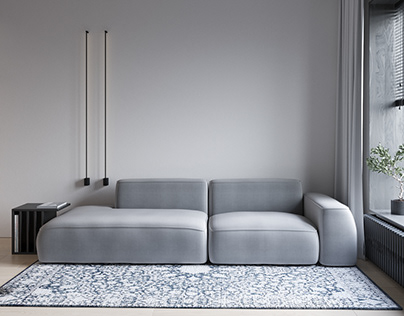
Find the location of a particular element. The height and width of the screenshot is (316, 404). back cushions is located at coordinates (146, 189), (254, 201).